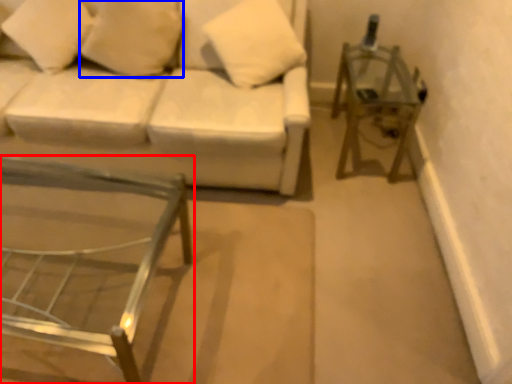
Question: Among these objects, which one is farthest to the camera, table (highlighted by a red box) or pillow (highlighted by a blue box)?

Choices:
 (A) table
 (B) pillow

Answer: (B)